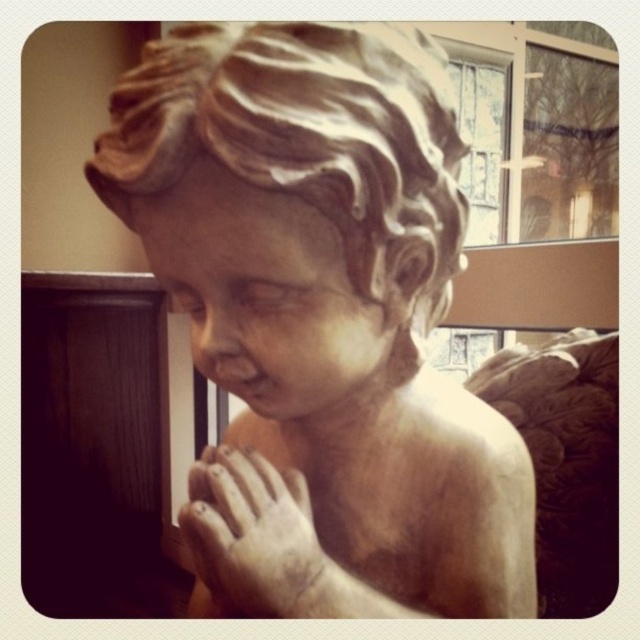
Question: Can you confirm if matte white statue at center is wider than matte stone hand at center?

Choices:
 (A) yes
 (B) no

Answer: (A)

Question: Which of the following is the farthest from the observer?

Choices:
 (A) matte stone hand at center
 (B) matte white statue at center

Answer: (A)

Question: Is matte white statue at center to the right of matte stone hand at center from the viewer's perspective?

Choices:
 (A) no
 (B) yes

Answer: (B)

Question: Which of the following is the closest to the observer?

Choices:
 (A) matte white statue at center
 (B) matte stone hand at center

Answer: (A)

Question: Is matte white statue at center smaller than matte stone hand at center?

Choices:
 (A) yes
 (B) no

Answer: (B)

Question: Which point appears farthest from the camera in this image?

Choices:
 (A) (147, 60)
 (B) (280, 477)

Answer: (B)